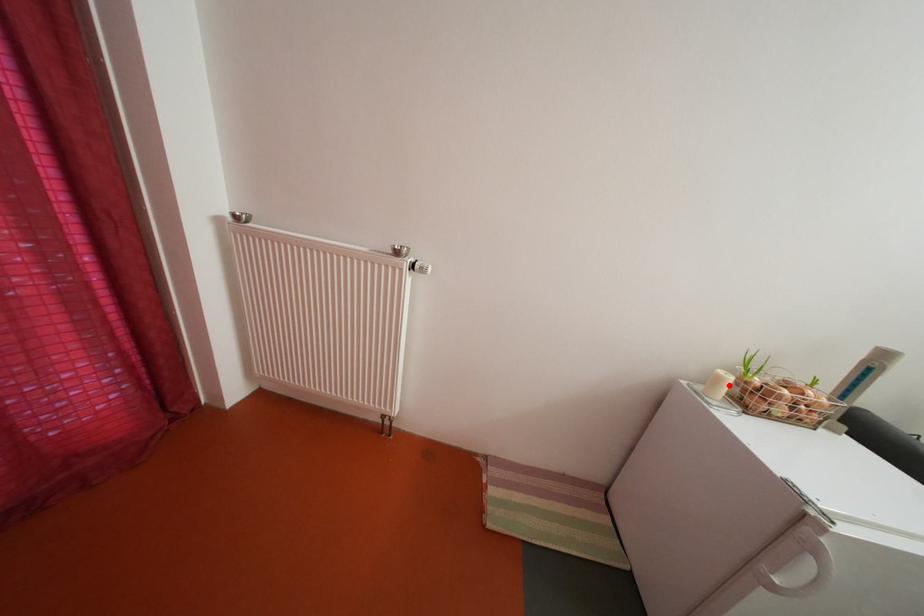
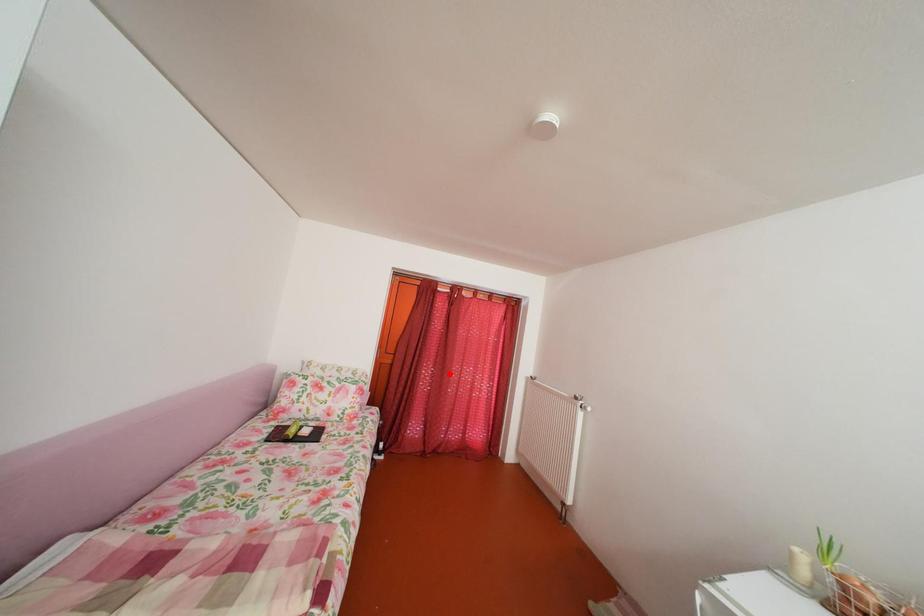
I am providing you with two images of the same scene from different viewpoints. A red point is marked on the first image and another point is marked on the second image. Is the red point in image1 aligned with the point shown in image2?

No